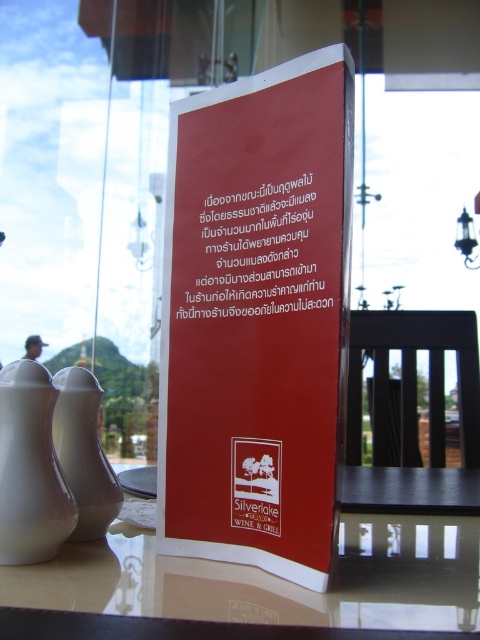
You are a server in a restaurant and need to place a 10cm wide coaster under the red matte sign at center to prevent water marks. Can the glossy glass table at center accommodate the coaster next to the sign?

The red matte sign at center is thinner than the glossy glass table at center, so the glossy glass table at center has enough space to place the coaster next to the sign.